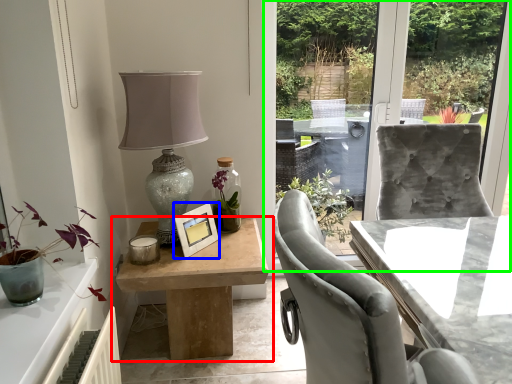
Question: Based on their relative distances, which object is nearer to table (highlighted by a red box)? Choose from picture frame (highlighted by a blue box) and window screen (highlighted by a green box).

Choices:
 (A) picture frame
 (B) window screen

Answer: (A)